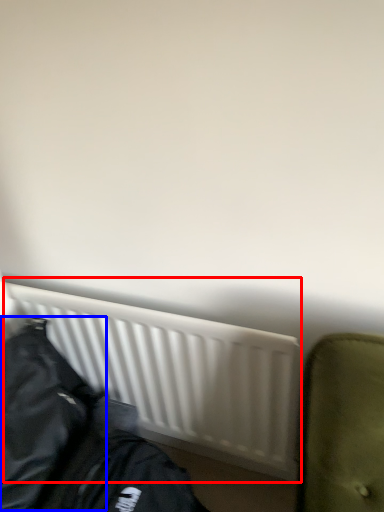
Question: Which object appears farthest to the camera in this image, radiator (highlighted by a red box) or jacket (highlighted by a blue box)?

Choices:
 (A) radiator
 (B) jacket

Answer: (A)